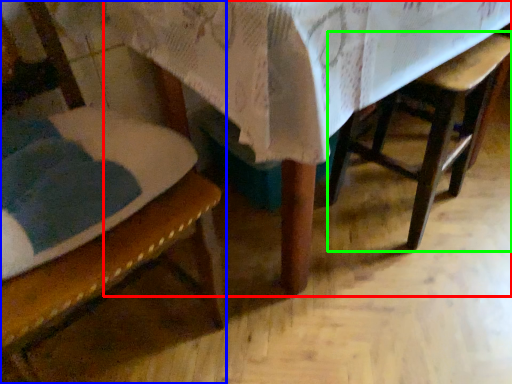
Question: Which object is positioned closest to table (highlighted by a red box)? Select from chair (highlighted by a blue box) and armchair (highlighted by a green box).

Choices:
 (A) chair
 (B) armchair

Answer: (A)